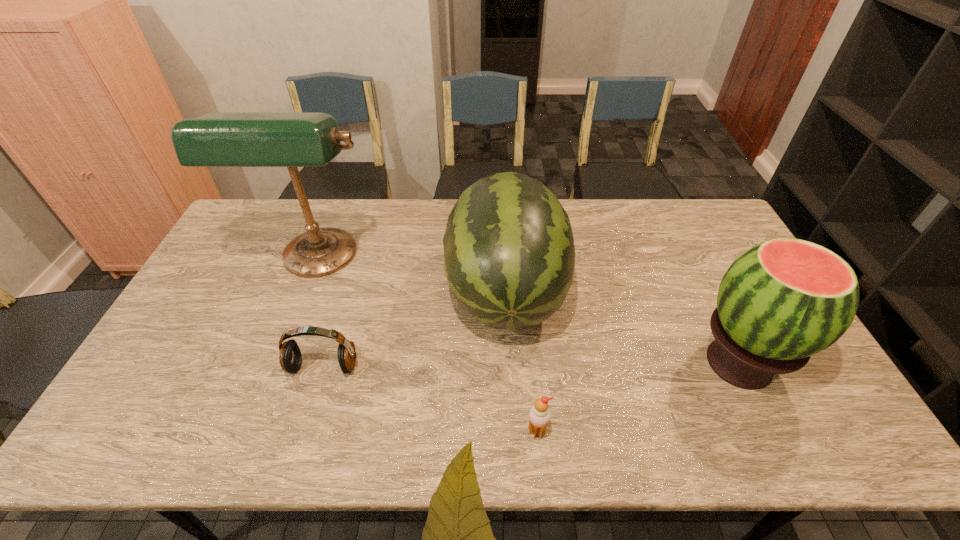
Find the location of a particular element. This screenshot has height=540, width=960. object that is at the near edge is located at coordinates click(x=539, y=415).

Identify the location of object positioned at the left edge. (219, 139).

At what (x,y) coordinates should I click in order to perform the action: click on object present at the right edge. Please return your answer as a coordinate pair (x, y). This screenshot has height=540, width=960. Looking at the image, I should click on (784, 300).

This screenshot has width=960, height=540. What are the coordinates of `object that is at the far left corner` in the screenshot? It's located at (219, 139).

Identify the location of vacant space at the far edge of the desktop. (670, 210).

In the image, there is a desktop. Where is `free region at the near edge`? This screenshot has height=540, width=960. free region at the near edge is located at coordinates [x=260, y=453].

Locate an element on the screen. The width and height of the screenshot is (960, 540). free region at the left edge of the desktop is located at coordinates (224, 258).

In order to click on free region at the right edge of the desktop in this screenshot , I will do `click(725, 256)`.

Where is `unoccupied area between the headset and the icecream`? This screenshot has height=540, width=960. unoccupied area between the headset and the icecream is located at coordinates (430, 399).

Identify the location of empty location between the table lamp and the icecream. (427, 346).